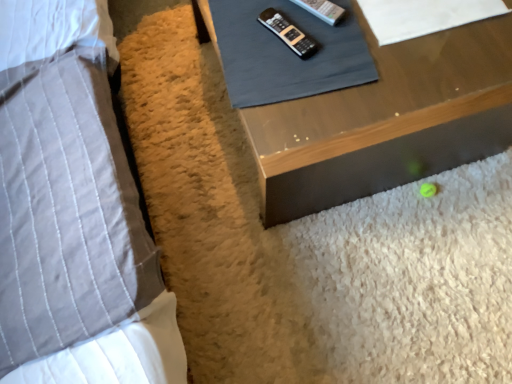
Question: Can you confirm if gray quilted pillow at left is thinner than black plastic remote at upper center?

Choices:
 (A) yes
 (B) no

Answer: (B)

Question: Is black plastic remote at upper center surrounded by gray quilted pillow at left?

Choices:
 (A) yes
 (B) no

Answer: (B)

Question: Is gray quilted pillow at left further to the viewer compared to black plastic remote at upper center?

Choices:
 (A) no
 (B) yes

Answer: (A)

Question: Would you consider gray quilted pillow at left to be distant from black plastic remote at upper center?

Choices:
 (A) no
 (B) yes

Answer: (A)

Question: Is gray quilted pillow at left completely or partially outside of black plastic remote at upper center?

Choices:
 (A) no
 (B) yes

Answer: (B)

Question: Based on their sizes in the image, would you say white paper at upper right, which is counted as the 1th sheet, starting from the right, is bigger or smaller than black plastic remote at upper center?

Choices:
 (A) big
 (B) small

Answer: (A)

Question: From a real-world perspective, is white paper at upper right, which is counted as the 1th sheet, starting from the right, physically located above or below black plastic remote at upper center?

Choices:
 (A) above
 (B) below

Answer: (A)

Question: From their relative heights in the image, would you say white paper at upper right, which is counted as the 1th sheet, starting from the right, is taller or shorter than black plastic remote at upper center?

Choices:
 (A) tall
 (B) short

Answer: (A)

Question: Would you say white paper at upper right, which is counted as the second sheet, starting from the left, is to the left or to the right of black plastic remote at upper center in the picture?

Choices:
 (A) right
 (B) left

Answer: (A)

Question: Considering their positions, is wooden table at lower right located in front of or behind gray quilted pillow at left?

Choices:
 (A) front
 (B) behind

Answer: (B)

Question: From a real-world perspective, is wooden table at lower right physically located above or below gray quilted pillow at left?

Choices:
 (A) below
 (B) above

Answer: (A)

Question: Looking at the image, does wooden table at lower right seem bigger or smaller compared to gray quilted pillow at left?

Choices:
 (A) small
 (B) big

Answer: (A)

Question: Is wooden table at lower right wider or thinner than gray quilted pillow at left?

Choices:
 (A) wide
 (B) thin

Answer: (A)

Question: Which is correct: gray fabric remote control at upper center, which is the first sheet from left to right, is inside black plastic remote at upper center, or outside of it?

Choices:
 (A) outside
 (B) inside

Answer: (A)

Question: Would you say gray fabric remote control at upper center, which is the first sheet from left to right, is to the left or to the right of black plastic remote at upper center in the picture?

Choices:
 (A) right
 (B) left

Answer: (A)